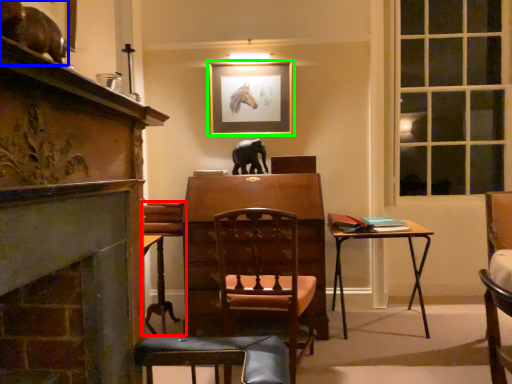
Question: Based on their relative distances, which object is farther from chair (highlighted by a red box)? Choose from animal (highlighted by a blue box) and picture frame (highlighted by a green box).

Choices:
 (A) animal
 (B) picture frame

Answer: (A)